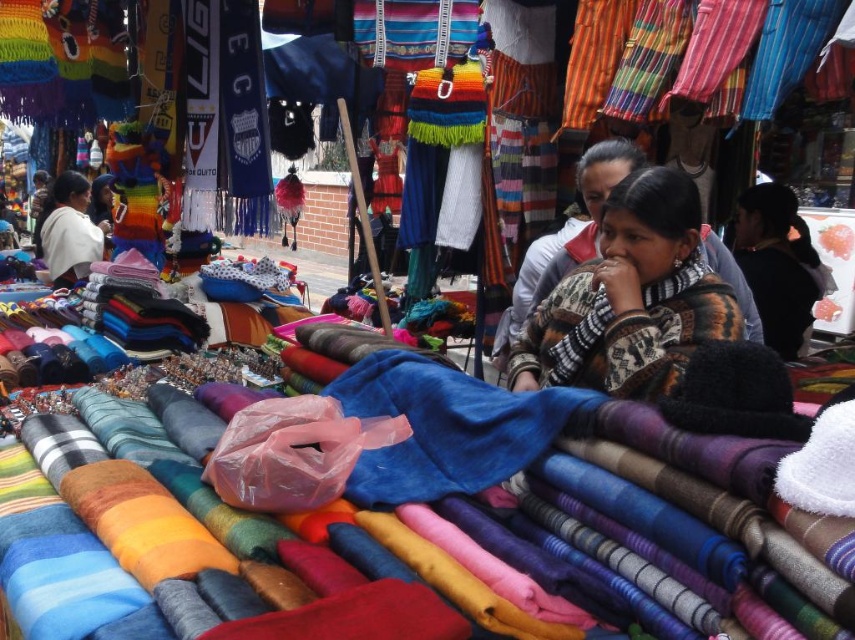
This screenshot has width=855, height=640. What do you see at coordinates (68, 230) in the screenshot?
I see `white woolen sweater at upper left` at bounding box center [68, 230].

Identify the location of white woolen sweater at upper left. (68, 230).

Which of these two, knitted sweater at center or white woolen sweater at upper left, stands shorter?

knitted sweater at center

The height and width of the screenshot is (640, 855). What do you see at coordinates (629, 298) in the screenshot?
I see `knitted sweater at center` at bounding box center [629, 298].

Locate an element on the screen. Image resolution: width=855 pixels, height=640 pixels. knitted sweater at center is located at coordinates (629, 298).

Does knitted sweater at center have a greater height compared to patterned wool scarf at center?

Indeed, knitted sweater at center has a greater height compared to patterned wool scarf at center.

Between knitted sweater at center and patterned wool scarf at center, which one has more height?

With more height is knitted sweater at center.

Which is in front, point (676, 346) or point (567, 337)?

Point (676, 346) is more forward.

In order to click on knitted sweater at center in this screenshot , I will do `click(629, 298)`.